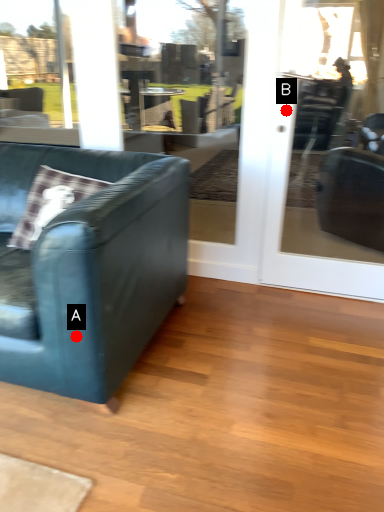
Question: Two points are circled on the image, labeled by A and B beside each circle. Which point appears closest to the camera in this image?

Choices:
 (A) A is closer
 (B) B is closer

Answer: (A)